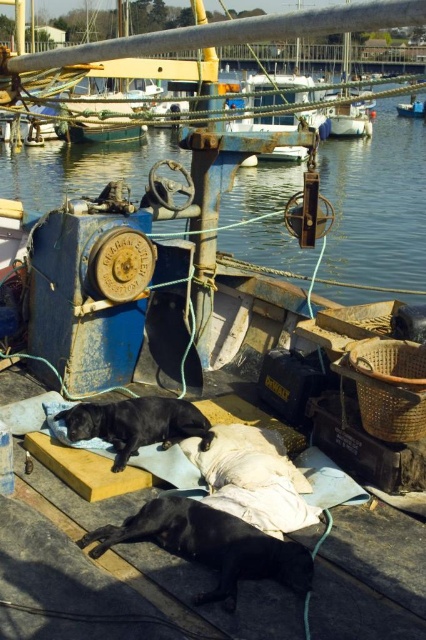
Is blue metallic water at center behind shiny black dog at lower center?

Yes.

Is blue metallic water at center bigger than shiny black dog at lower center?

Indeed, blue metallic water at center has a larger size compared to shiny black dog at lower center.

Is point (54, 172) behind point (247, 566)?

Yes, point (54, 172) is behind point (247, 566).

The height and width of the screenshot is (640, 426). Find the location of `blue metallic water at center`. blue metallic water at center is located at coordinates (377, 209).

Who is taller, blue metallic water at center or black matte dog at center?

blue metallic water at center is taller.

Is blue metallic water at center closer to the viewer compared to black matte dog at center?

No, blue metallic water at center is further to the viewer.

Find the location of a particular element. blue metallic water at center is located at coordinates (377, 209).

The width and height of the screenshot is (426, 640). In order to click on blue metallic water at center in this screenshot , I will do `click(377, 209)`.

Can you confirm if shiny black dog at lower center is positioned above black matte dog at center?

Actually, shiny black dog at lower center is below black matte dog at center.

What do you see at coordinates (210, 545) in the screenshot? I see `shiny black dog at lower center` at bounding box center [210, 545].

The image size is (426, 640). I want to click on shiny black dog at lower center, so [x=210, y=545].